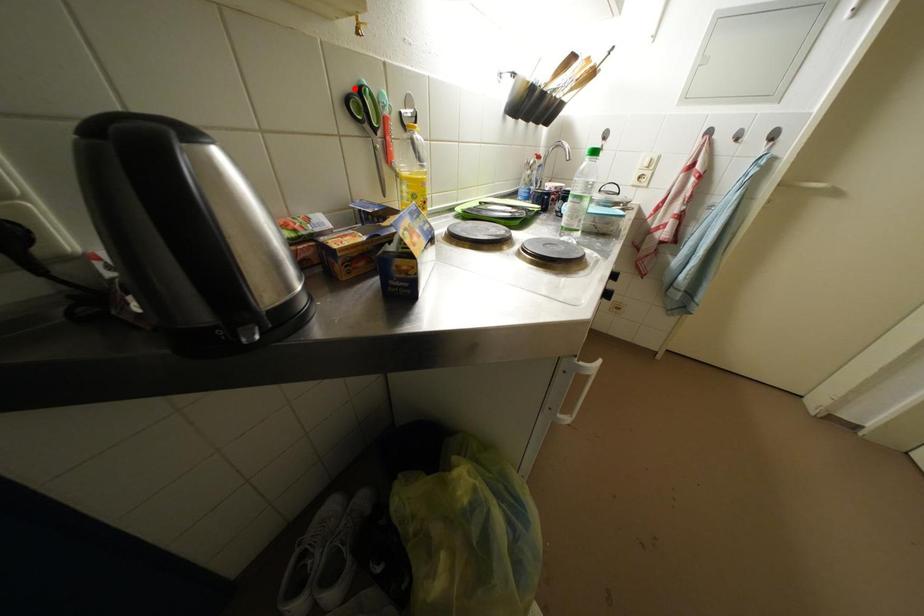
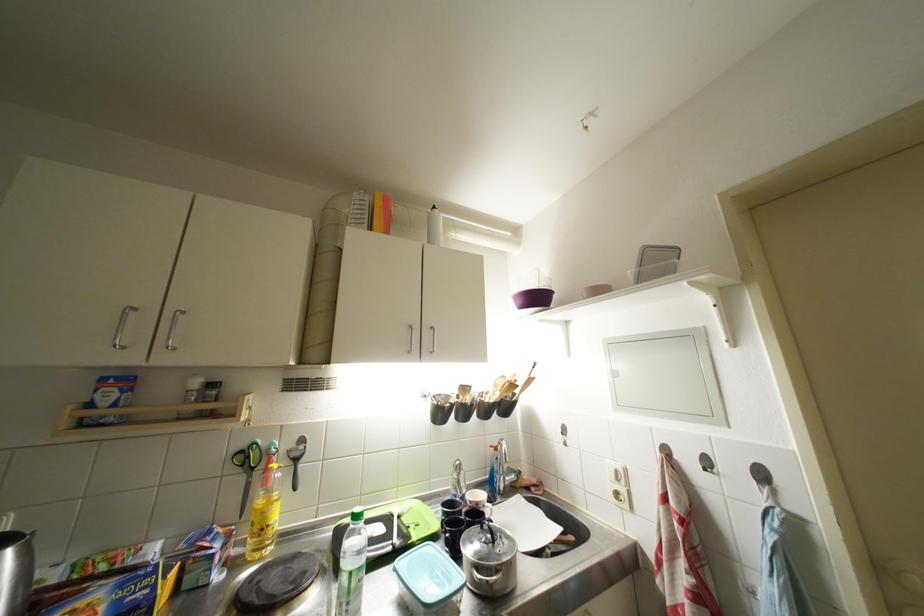
Where in the second image is the point corresponding to the highlighted location from the first image?

(249, 450)